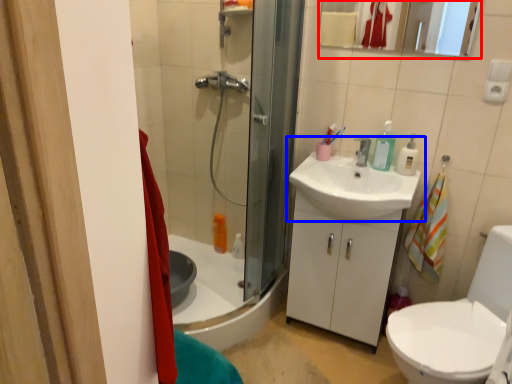
Question: Which of the following is the closest to the observer, mirror (highlighted by a red box) or sink (highlighted by a blue box)?

Choices:
 (A) mirror
 (B) sink

Answer: (B)